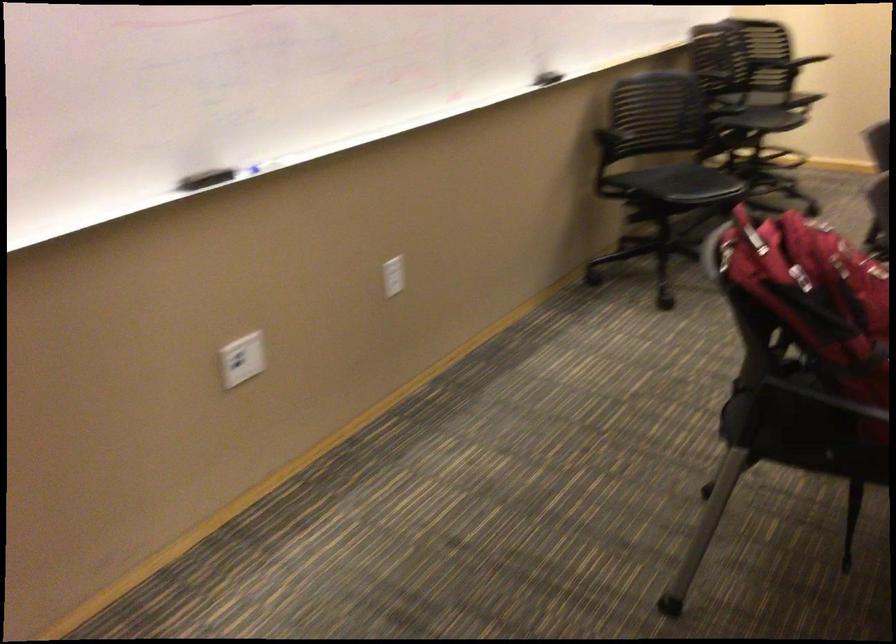
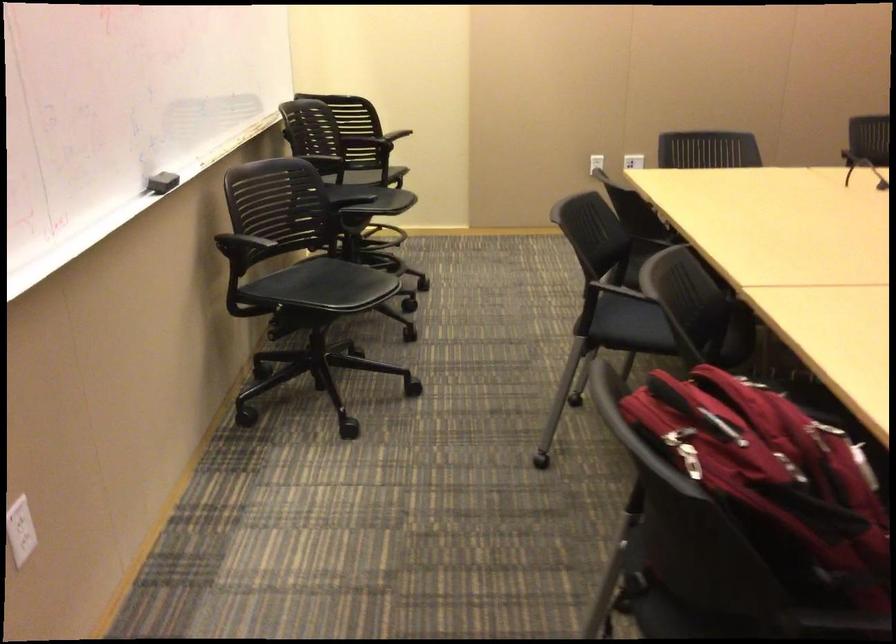
Question: I am providing you with two images of the same scene from different viewpoints. Which of the following objects are not visible in image2?

Choices:
 (A) black chair surface
 (B) red backpack
 (C) black whiteboard eraser
 (D) none of these

Answer: (D)